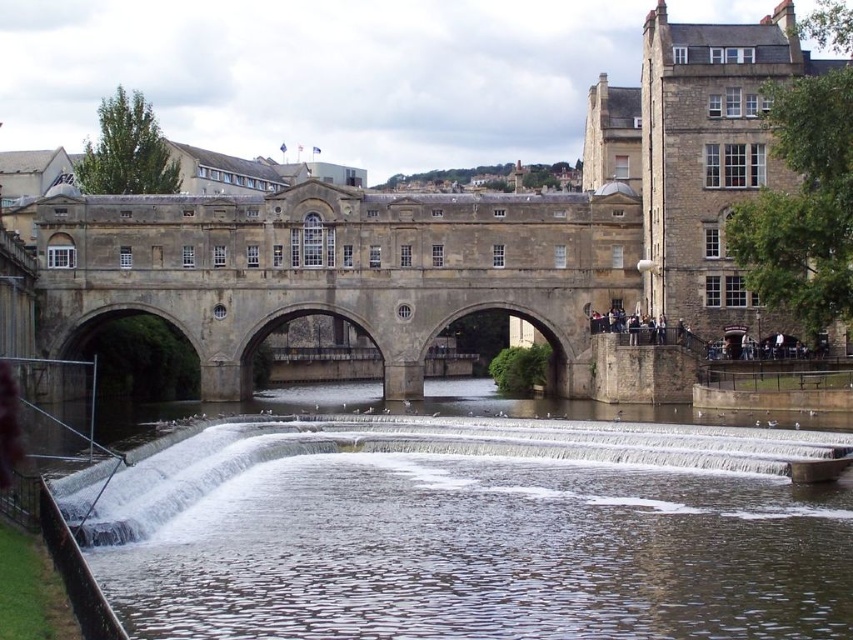
Is brown stone river at lower center below stone bridge at center?

Correct, brown stone river at lower center is located below stone bridge at center.

Is brown stone river at lower center taller than stone bridge at center?

No, brown stone river at lower center is not taller than stone bridge at center.

Which is behind, point (67, 506) or point (135, 264)?

The point (135, 264) is more distant.

The image size is (853, 640). What are the coordinates of `brown stone river at lower center` in the screenshot? It's located at (474, 529).